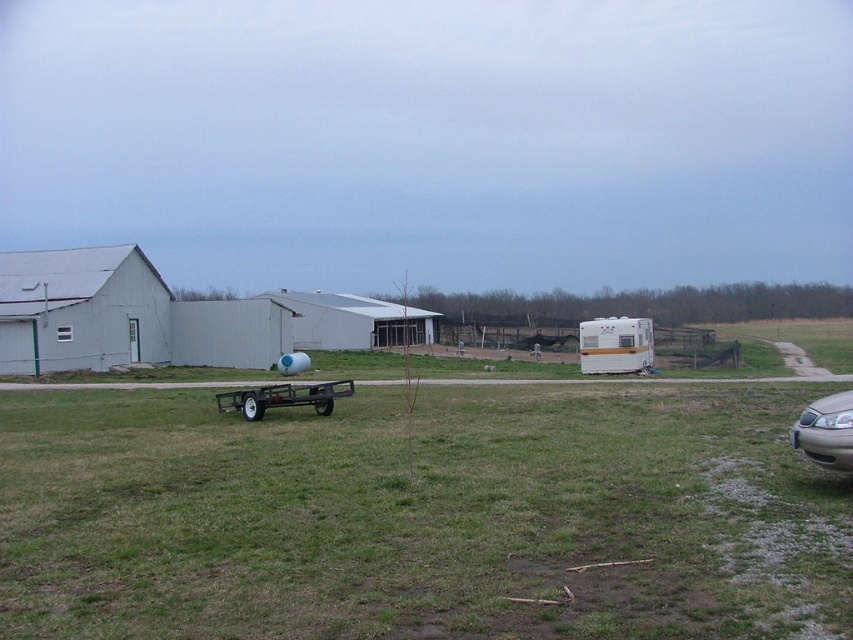
Is point (138, 291) positioned behind point (648, 355)?

Yes, point (138, 291) is behind point (648, 355).

Is the position of white matte barn at left less distant than that of white vinyl camper at center-right?

No, white matte barn at left is further to the viewer.

The image size is (853, 640). In order to click on white matte barn at left in this screenshot , I will do `click(80, 308)`.

Is gold metallic sedan at lower right bigger than metallic trailer at center?

Yes.

Is gold metallic sedan at lower right positioned behind metallic trailer at center?

No.

The image size is (853, 640). Describe the element at coordinates (827, 432) in the screenshot. I see `gold metallic sedan at lower right` at that location.

The width and height of the screenshot is (853, 640). I want to click on gold metallic sedan at lower right, so click(x=827, y=432).

Which of these two, green grass at center or white matte barn at left, stands taller?

With more height is white matte barn at left.

Does green grass at center appear on the right side of white matte barn at left?

Correct, you'll find green grass at center to the right of white matte barn at left.

Does point (369, 556) come closer to viewer compared to point (128, 269)?

Yes, point (369, 556) is in front of point (128, 269).

You are a GUI agent. You are given a task and a screenshot of the screen. Output one action in this format:
    pyautogui.click(x=<x>, y=<y>)
    Task: Click on the green grass at center
    The width and height of the screenshot is (853, 640).
    Given the screenshot: What is the action you would take?
    pyautogui.click(x=421, y=516)